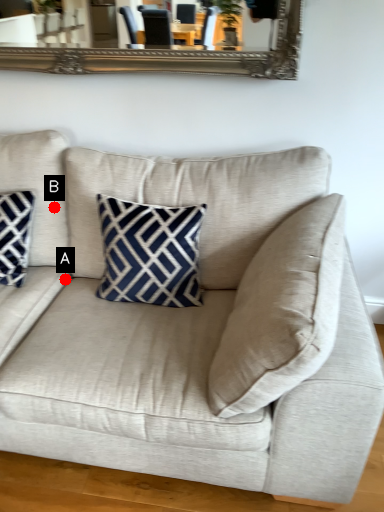
Question: Two points are circled on the image, labeled by A and B beside each circle. Which point appears closest to the camera in this image?

Choices:
 (A) A is closer
 (B) B is closer

Answer: (B)